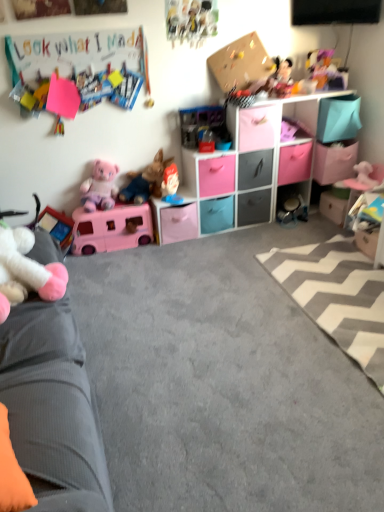
This screenshot has height=512, width=384. Find the location of `vacant area that is in front of matte pink plastic camper at lower left, the third toy in the left-to-right sequence`. vacant area that is in front of matte pink plastic camper at lower left, the third toy in the left-to-right sequence is located at coordinates click(x=118, y=275).